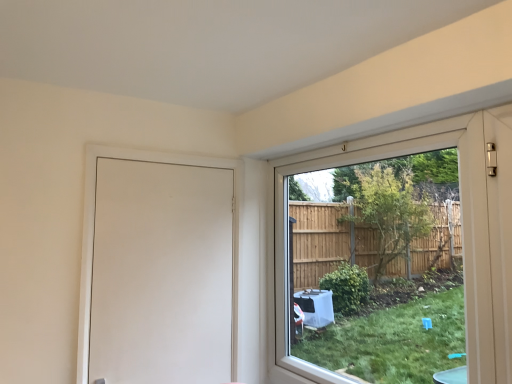
Question: Is white matte door at left taller than clear glass window at right?

Choices:
 (A) no
 (B) yes

Answer: (A)

Question: Is white matte door at left in front of clear glass window at right?

Choices:
 (A) no
 (B) yes

Answer: (A)

Question: From a real-world perspective, is white matte door at left below clear glass window at right?

Choices:
 (A) yes
 (B) no

Answer: (A)

Question: Is the depth of white matte door at left greater than that of clear glass window at right?

Choices:
 (A) no
 (B) yes

Answer: (B)

Question: Would you say white matte door at left contains clear glass window at right?

Choices:
 (A) no
 (B) yes

Answer: (A)

Question: From a real-world perspective, does white matte door at left stand above clear glass window at right?

Choices:
 (A) yes
 (B) no

Answer: (B)

Question: Can you confirm if clear glass window at right is shorter than white matte door at left?

Choices:
 (A) yes
 (B) no

Answer: (B)

Question: Considering the relative sizes of clear glass window at right and white matte door at left in the image provided, is clear glass window at right thinner than white matte door at left?

Choices:
 (A) no
 (B) yes

Answer: (A)

Question: Is clear glass window at right next to white matte door at left and touching it?

Choices:
 (A) yes
 (B) no

Answer: (B)

Question: From the image's perspective, is clear glass window at right above white matte door at left?

Choices:
 (A) no
 (B) yes

Answer: (B)

Question: Considering the relative positions of clear glass window at right and white matte door at left in the image provided, is clear glass window at right to the left of white matte door at left from the viewer's perspective?

Choices:
 (A) no
 (B) yes

Answer: (A)

Question: From a real-world perspective, is clear glass window at right located beneath white matte door at left?

Choices:
 (A) no
 (B) yes

Answer: (A)

Question: From the image's perspective, is clear glass window at right located above or below white matte door at left?

Choices:
 (A) above
 (B) below

Answer: (A)